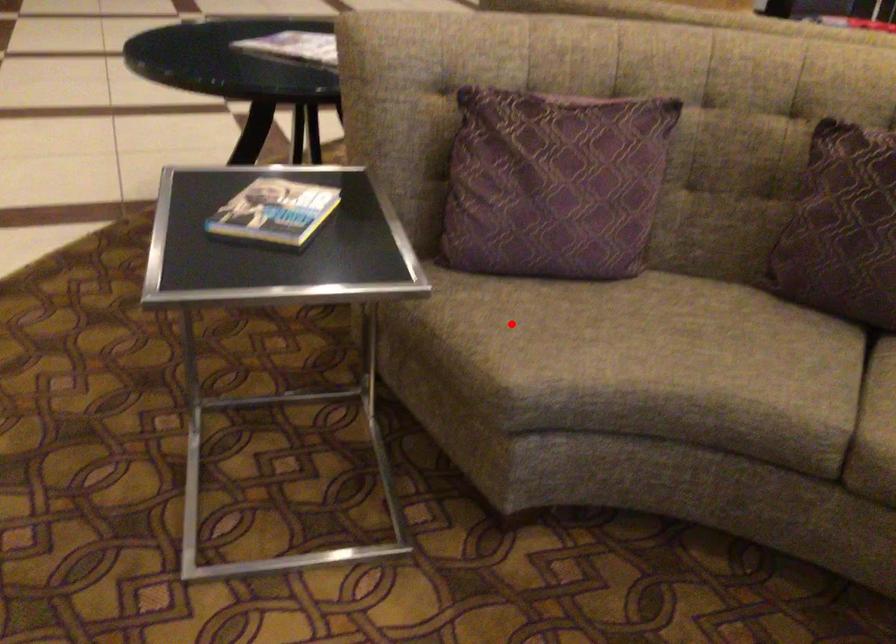
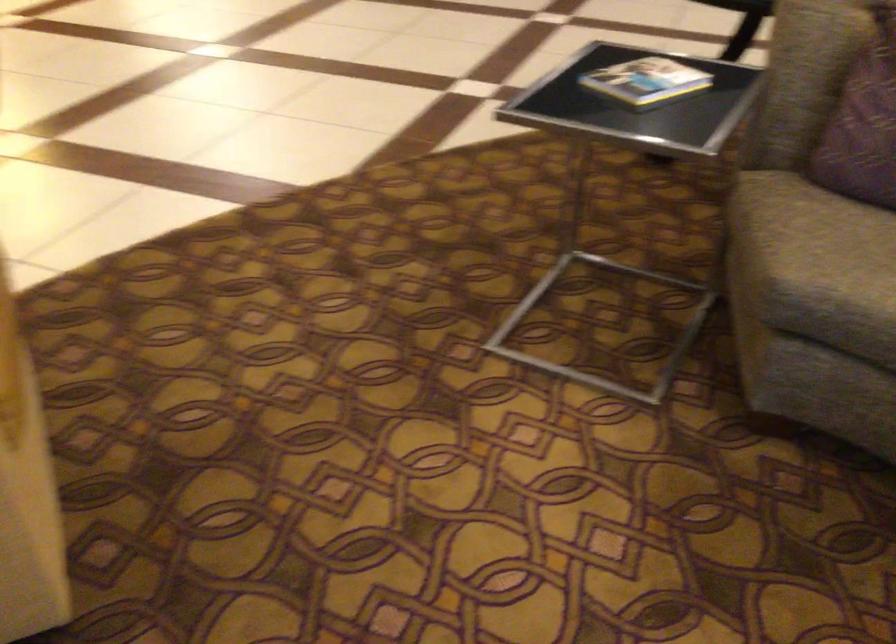
The point at the highlighted location is marked in the first image. Where is the corresponding point in the second image?

(822, 234)